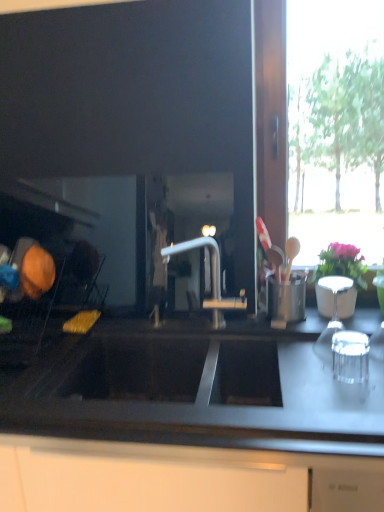
Question: Is pink matte vase at upper right to the right of black matte countertop at center from the viewer's perspective?

Choices:
 (A) yes
 (B) no

Answer: (A)

Question: Is the depth of pink matte vase at upper right less than that of black matte countertop at center?

Choices:
 (A) yes
 (B) no

Answer: (B)

Question: Is pink matte vase at upper right smaller than black matte countertop at center?

Choices:
 (A) no
 (B) yes

Answer: (B)

Question: Can you see pink matte vase at upper right touching black matte countertop at center?

Choices:
 (A) no
 (B) yes

Answer: (A)

Question: Is pink matte vase at upper right facing towards black matte countertop at center?

Choices:
 (A) yes
 (B) no

Answer: (B)

Question: From a real-world perspective, does pink matte vase at upper right stand above black matte countertop at center?

Choices:
 (A) no
 (B) yes

Answer: (B)

Question: Is black matte countertop at center thinner than pink matte vase at upper right?

Choices:
 (A) no
 (B) yes

Answer: (A)

Question: Is black matte countertop at center wider than pink matte vase at upper right?

Choices:
 (A) no
 (B) yes

Answer: (B)

Question: From the image's perspective, is black matte countertop at center located beneath pink matte vase at upper right?

Choices:
 (A) yes
 (B) no

Answer: (A)

Question: Is the position of black matte countertop at center less distant than that of pink matte vase at upper right?

Choices:
 (A) yes
 (B) no

Answer: (A)

Question: Can you confirm if black matte countertop at center is taller than pink matte vase at upper right?

Choices:
 (A) no
 (B) yes

Answer: (B)

Question: Is black matte countertop at center far from pink matte vase at upper right?

Choices:
 (A) no
 (B) yes

Answer: (A)

Question: Looking at the image, does pink matte vase at upper right seem bigger or smaller compared to black matte countertop at center?

Choices:
 (A) big
 (B) small

Answer: (B)